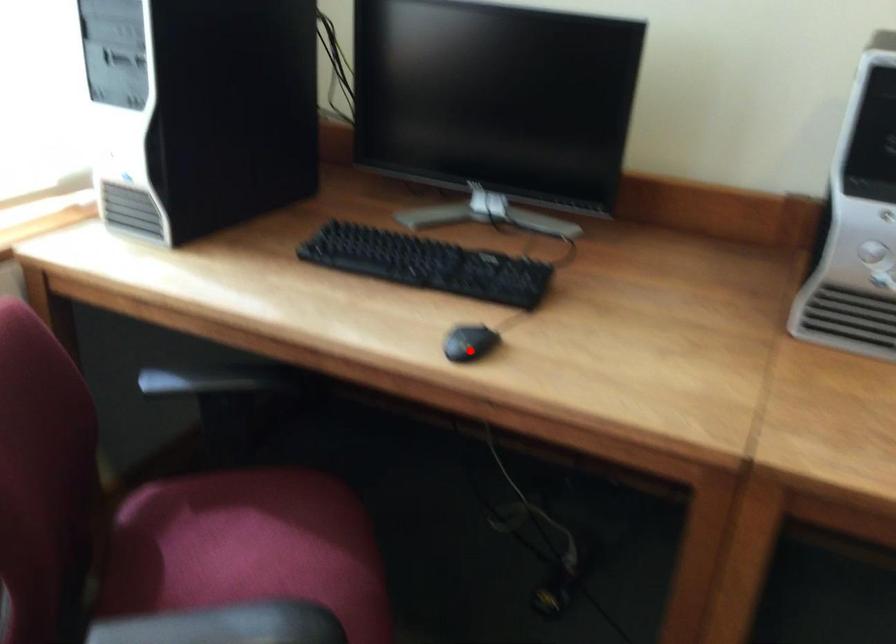
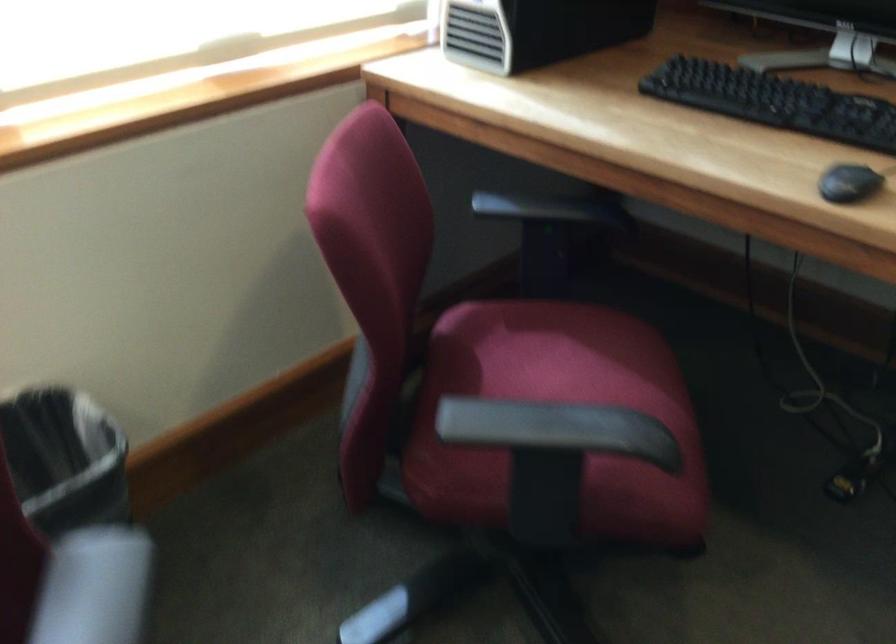
Question: I am providing you with two images of the same scene from different viewpoints. Given a red point in image1, look at the same physical point in image2. Is it:

Choices:
 (A) Closer to the viewpoint
 (B) Farther from the viewpoint

Answer: (A)